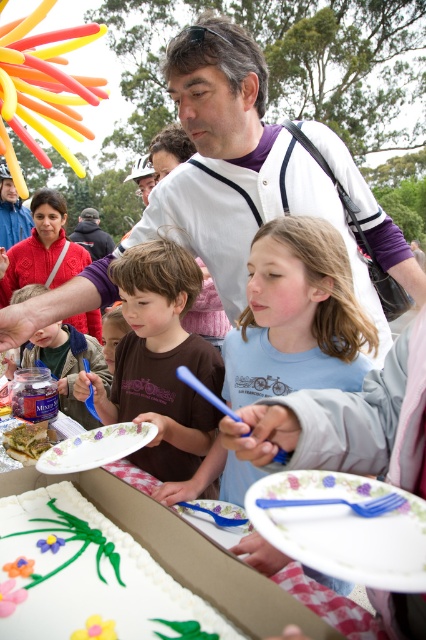
Is light blue cotton shirt at center smaller than porcelain floral plate at lower left?

No, light blue cotton shirt at center is not smaller than porcelain floral plate at lower left.

Can you confirm if light blue cotton shirt at center is positioned below porcelain floral plate at lower left?

Incorrect, light blue cotton shirt at center is not positioned below porcelain floral plate at lower left.

Measure the distance between light blue cotton shirt at center and camera.

light blue cotton shirt at center and camera are 4.27 feet apart from each other.

Find the location of a particular element. This screenshot has height=640, width=426. light blue cotton shirt at center is located at coordinates (296, 316).

Is the position of white fondant cake at lower left less distant than that of brown cotton shirt at center?

Yes, white fondant cake at lower left is closer to the viewer.

Can you confirm if white fondant cake at lower left is thinner than brown cotton shirt at center?

Yes, white fondant cake at lower left is thinner than brown cotton shirt at center.

Locate an element on the screen. This screenshot has width=426, height=640. white fondant cake at lower left is located at coordinates (89, 577).

What do you see at coordinates (227, 106) in the screenshot? This screenshot has width=426, height=640. I see `white jersey at center` at bounding box center [227, 106].

How far apart are white jersey at center and green leafy vegetable at center?

white jersey at center is 36.44 inches from green leafy vegetable at center.

Image resolution: width=426 pixels, height=640 pixels. What do you see at coordinates (227, 106) in the screenshot?
I see `white jersey at center` at bounding box center [227, 106].

Where is `white jersey at center`? This screenshot has height=640, width=426. white jersey at center is located at coordinates (227, 106).